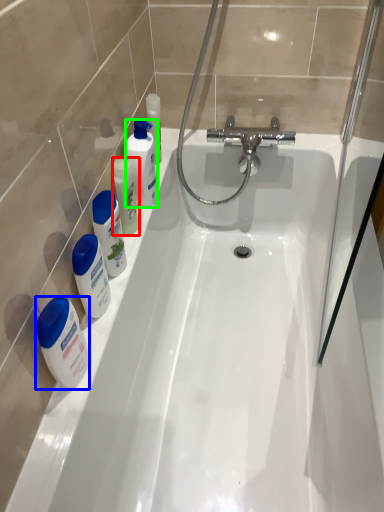
Question: Estimate the real-world distances between objects in this image. Which object is closer to mouthwash (highlighted by a red box), mouthwash (highlighted by a blue box) or cleaning product (highlighted by a green box)?

Choices:
 (A) mouthwash
 (B) cleaning product

Answer: (B)